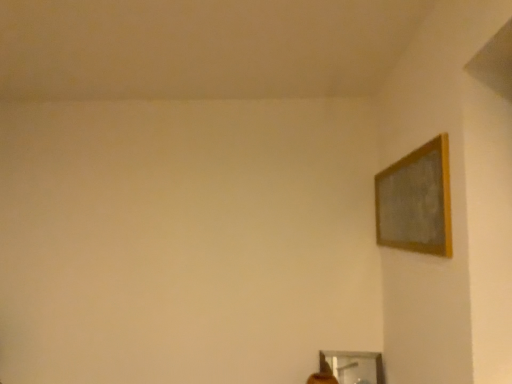
The width and height of the screenshot is (512, 384). Describe the element at coordinates (353, 366) in the screenshot. I see `transparent glass window at lower right` at that location.

You are a GUI agent. You are given a task and a screenshot of the screen. Output one action in this format:
    pyautogui.click(x=<x>, y=<y>)
    Task: Click on the transparent glass window at lower right
    
    Given the screenshot: What is the action you would take?
    pyautogui.click(x=353, y=366)

At what (x,y) coordinates should I click in order to perform the action: click on transparent glass window at lower right. Please return your answer as a coordinate pair (x, y). Looking at the image, I should click on (353, 366).